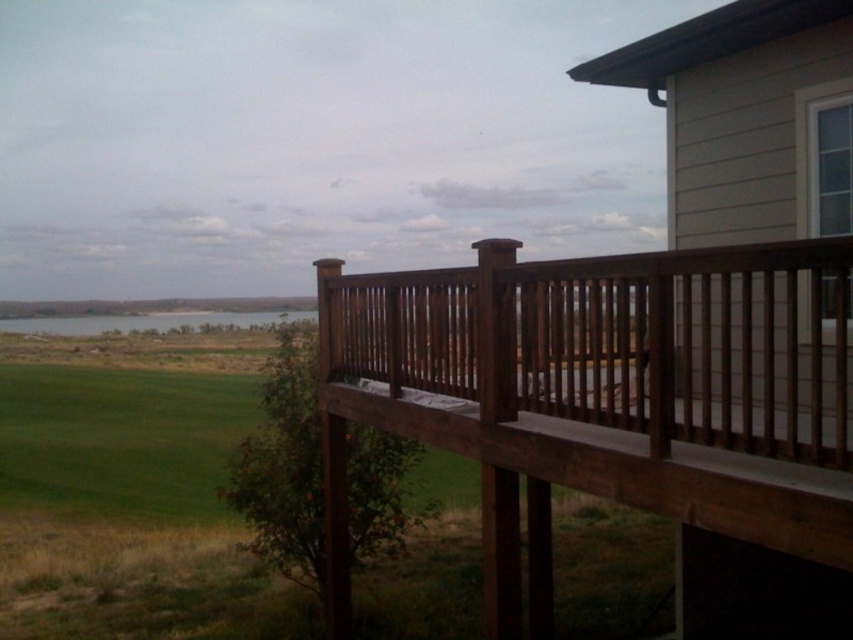
Question: Which point is closer to the camera taking this photo?

Choices:
 (A) coord(57,321)
 (B) coord(576,465)

Answer: (B)

Question: Does brown wood porch at right appear under green grassy field at lower left?

Choices:
 (A) yes
 (B) no

Answer: (A)

Question: Which point is farther to the camera?

Choices:
 (A) (836, 586)
 (B) (47, 317)

Answer: (B)

Question: Can you confirm if brown wood porch at right is positioned below green grassy field at lower left?

Choices:
 (A) yes
 (B) no

Answer: (A)

Question: Is brown wood porch at right behind green grassy field at lower left?

Choices:
 (A) yes
 (B) no

Answer: (B)